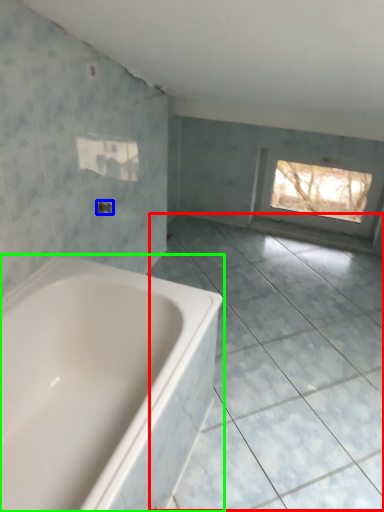
Question: Based on their relative distances, which object is nearer to ceramic tile (highlighted by a red box)? Choose from tap (highlighted by a blue box) and bathtub (highlighted by a green box).

Choices:
 (A) tap
 (B) bathtub

Answer: (B)